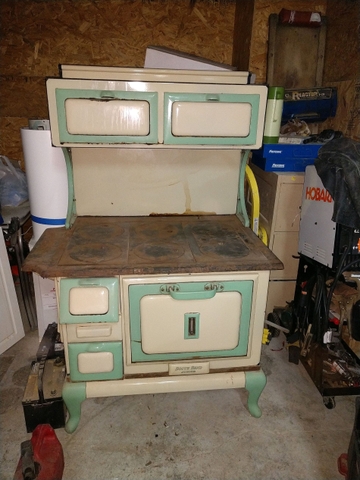
Identify the location of burners. The image size is (360, 480). (93, 247), (96, 227), (154, 227), (156, 248), (220, 227).